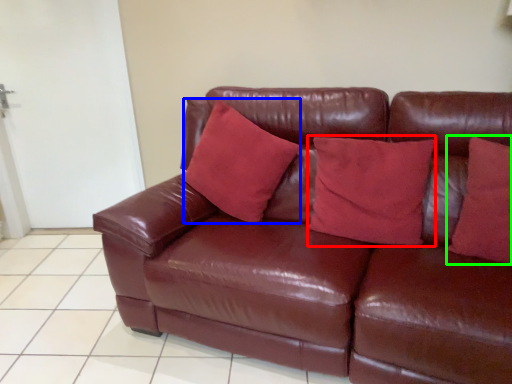
Question: Which object is the farthest from pillow (highlighted by a red box)? Choose among these: pillow (highlighted by a blue box) or pillow (highlighted by a green box).

Choices:
 (A) pillow
 (B) pillow

Answer: (A)